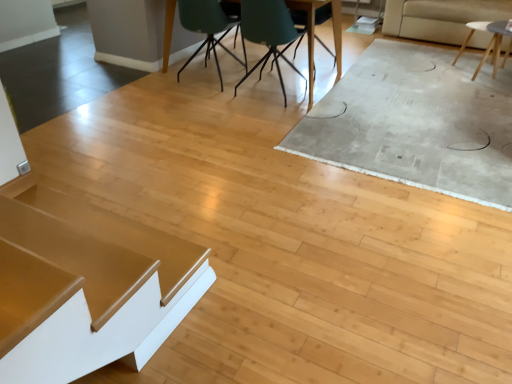
I want to click on free space above shiny gold table at lower left, the first table when ordered from front to back (from a real-world perspective), so click(58, 237).